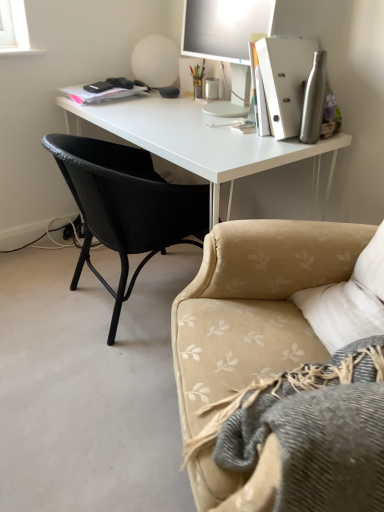
This screenshot has width=384, height=512. I want to click on vacant area that lies between black woven chair at left and white matte desk at center, so click(x=91, y=264).